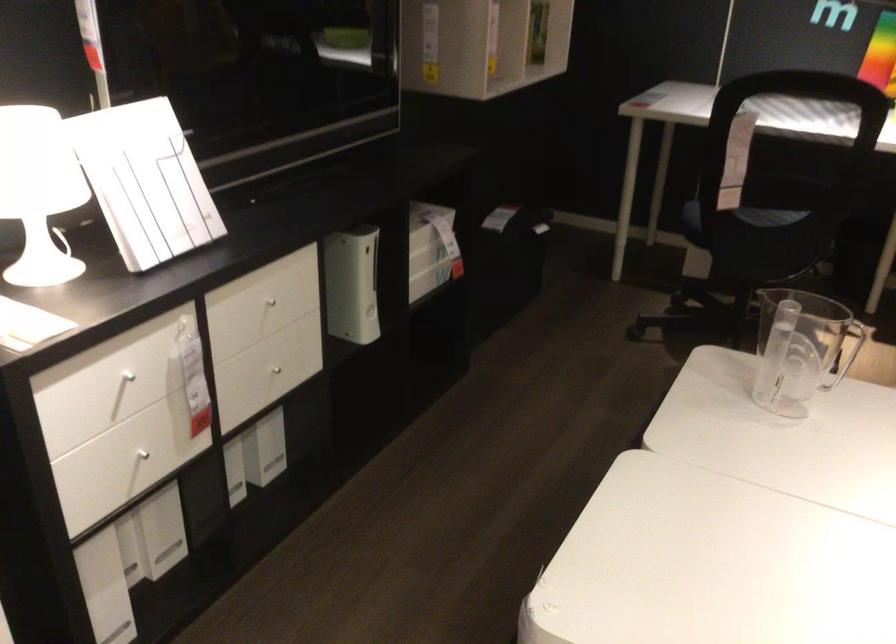
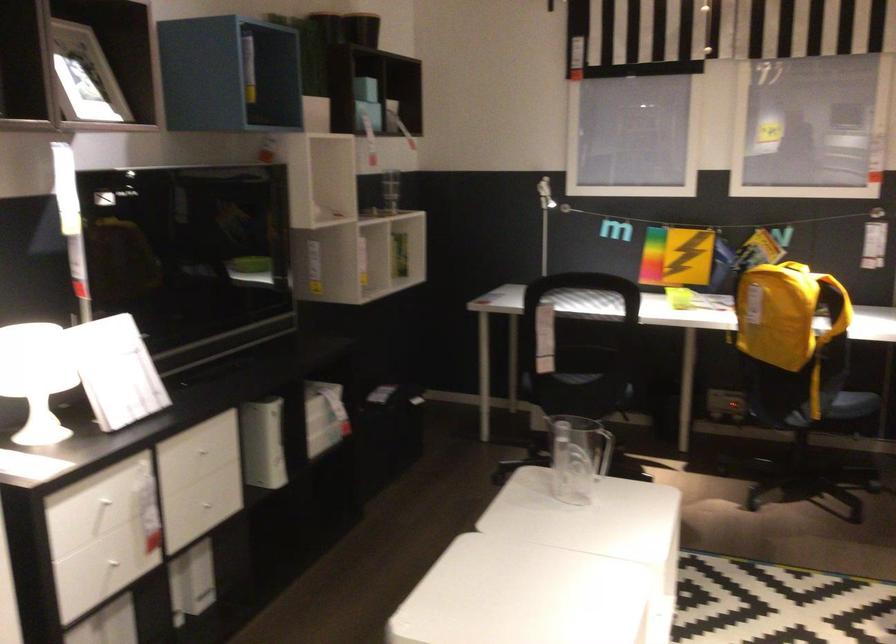
Locate, in the second image, the point that corresponds to the point at 268,306 in the first image.

(203, 457)